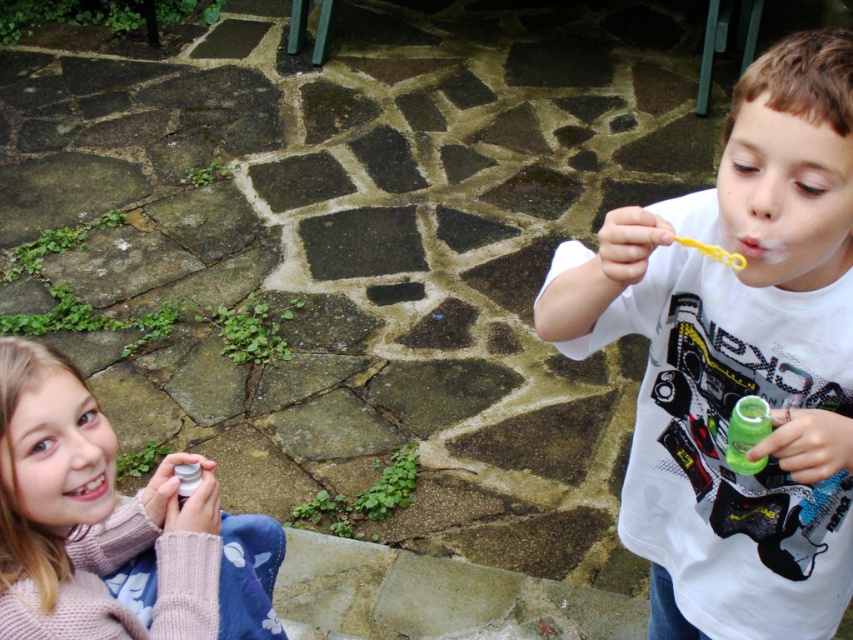
In the scene shown: How distant is white matte shirt at center from green translucent bottle at right?

white matte shirt at center and green translucent bottle at right are 11.93 inches apart from each other.

Can you confirm if white matte shirt at center is thinner than green translucent bottle at right?

In fact, white matte shirt at center might be wider than green translucent bottle at right.

Is point (814, 529) positioned behind point (743, 433)?

Yes, point (814, 529) is farther from viewer.

Where is `white matte shirt at center`? The image size is (853, 640). white matte shirt at center is located at coordinates (737, 358).

Between pink knitted sweater at lower left and white glossy teeth at lower left, which one is positioned lower?

pink knitted sweater at lower left

Locate an element on the screen. Image resolution: width=853 pixels, height=640 pixels. pink knitted sweater at lower left is located at coordinates (113, 529).

Does white glossy teeth at lower left have a smaller size compared to smooth yellow toothbrush at upper right?

Actually, white glossy teeth at lower left might be larger than smooth yellow toothbrush at upper right.

Between point (91, 493) and point (761, 259), which one is positioned in front?

Point (761, 259)

The height and width of the screenshot is (640, 853). Find the location of `white glossy teeth at lower left`. white glossy teeth at lower left is located at coordinates (90, 484).